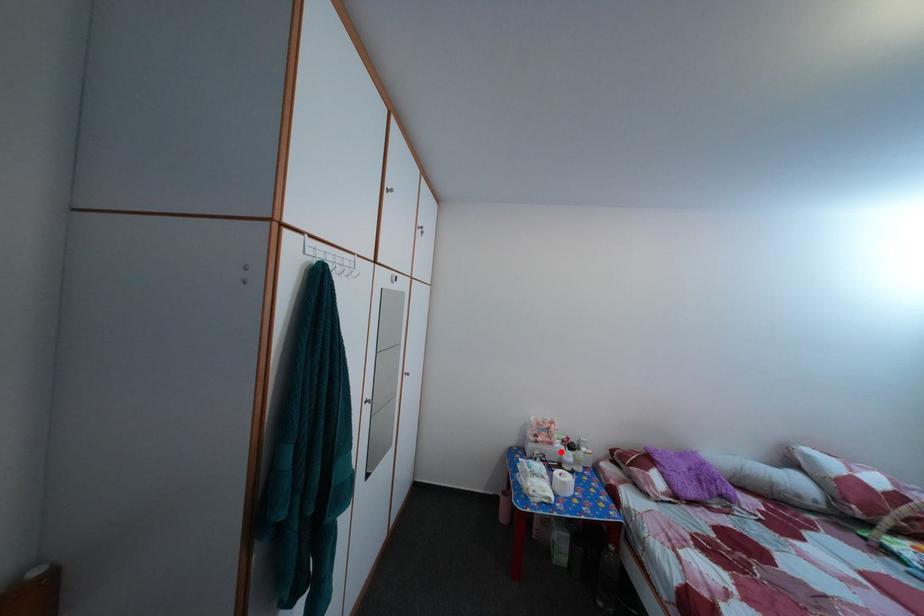
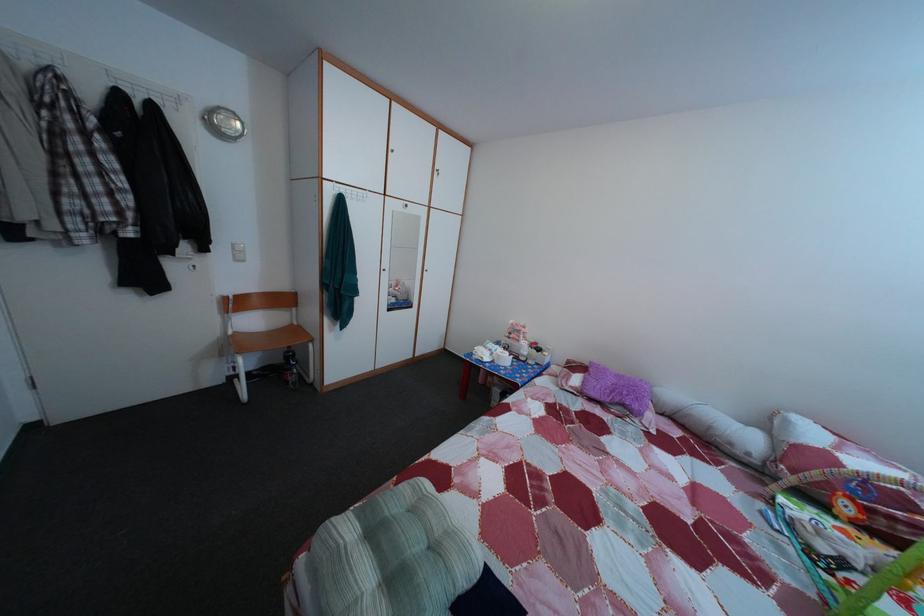
Find the pixel in the second image that matches the highlighted location in the first image.

(528, 349)